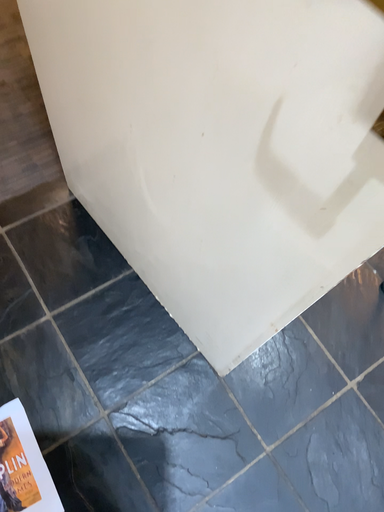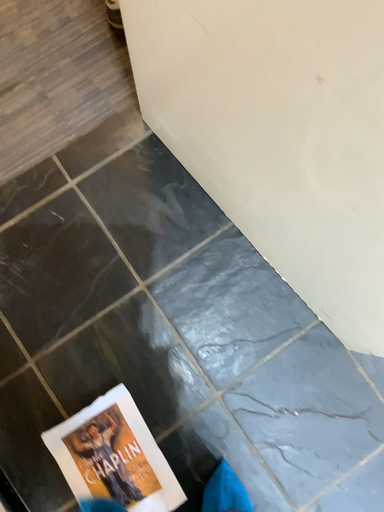
Question: How did the camera likely rotate when shooting the video?

Choices:
 (A) rotated upward
 (B) rotated downward

Answer: (B)